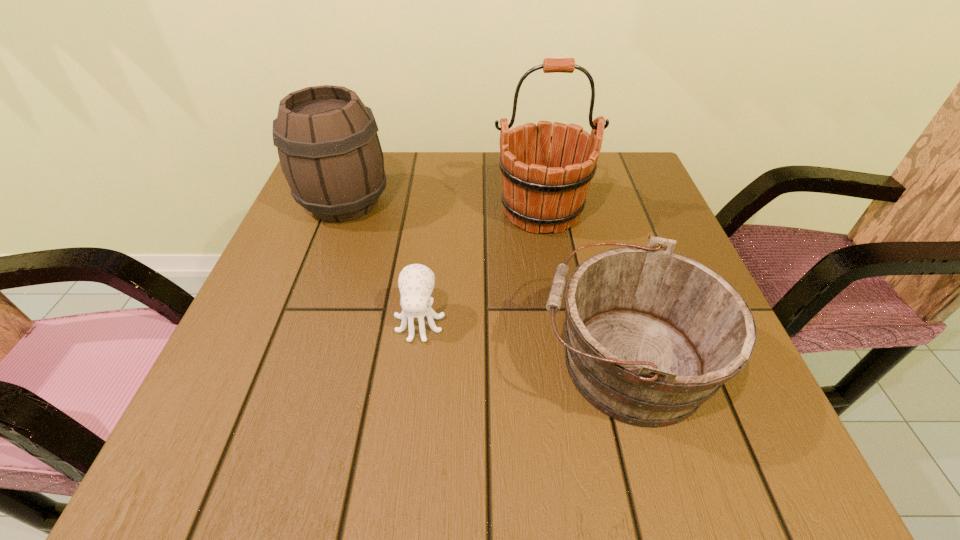
Locate an element on the screen. object that is the third closest to the third shortest object is located at coordinates (651, 335).

Choose which wine bucket is the nearest neighbor to the tallest object. Please provide its 2D coordinates. Your answer should be formatted as a tuple, i.e. [(x, y)], where the tuple contains the x and y coordinates of a point satisfying the conditions above.

[(651, 335)]

Locate which wine bucket is the second closest to the second shortest wine bucket. Please provide its 2D coordinates. Your answer should be formatted as a tuple, i.e. [(x, y)], where the tuple contains the x and y coordinates of a point satisfying the conditions above.

[(651, 335)]

Image resolution: width=960 pixels, height=540 pixels. What are the coordinates of `vacant space that satisfies the following two spatial constraints: 1. on the front side of the shortest wine bucket; 2. on the left side of the leftmost wine bucket` in the screenshot? It's located at (287, 361).

Where is `free location that satisfies the following two spatial constraints: 1. on the front-facing side of the shortest wine bucket; 2. on the left side of the octopus`? This screenshot has width=960, height=540. free location that satisfies the following two spatial constraints: 1. on the front-facing side of the shortest wine bucket; 2. on the left side of the octopus is located at coordinates (415, 361).

Identify the location of free space that satisfies the following two spatial constraints: 1. on the front-facing side of the nearest wine bucket; 2. on the left side of the shortest object. This screenshot has height=540, width=960. (415, 361).

Find the location of a particular element. vacant space that satisfies the following two spatial constraints: 1. on the front side of the tallest wine bucket; 2. on the left side of the leftmost wine bucket is located at coordinates (342, 211).